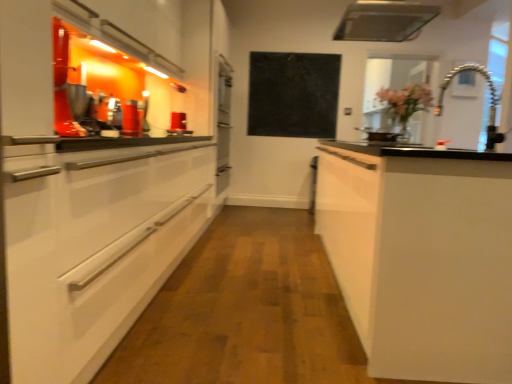
Question: Would you say flexible metallic faucet at upper right contains white matte cabinet at right?

Choices:
 (A) no
 (B) yes

Answer: (A)

Question: Is flexible metallic faucet at upper right further to camera compared to white matte cabinet at right?

Choices:
 (A) no
 (B) yes

Answer: (B)

Question: Is flexible metallic faucet at upper right placed right next to white matte cabinet at right?

Choices:
 (A) yes
 (B) no

Answer: (B)

Question: From the image's perspective, is flexible metallic faucet at upper right beneath white matte cabinet at right?

Choices:
 (A) yes
 (B) no

Answer: (B)

Question: Does flexible metallic faucet at upper right turn towards white matte cabinet at right?

Choices:
 (A) yes
 (B) no

Answer: (B)

Question: Based on their positions, is flexible metallic faucet at upper right located to the left or right of white matte cabinet at right?

Choices:
 (A) left
 (B) right

Answer: (B)

Question: Looking at their shapes, would you say flexible metallic faucet at upper right is wider or thinner than white matte cabinet at right?

Choices:
 (A) thin
 (B) wide

Answer: (A)

Question: Does point (494, 119) appear closer or farther from the camera than point (424, 253)?

Choices:
 (A) farther
 (B) closer

Answer: (A)

Question: From the image's perspective, is flexible metallic faucet at upper right above or below white matte cabinet at right?

Choices:
 (A) below
 (B) above

Answer: (B)

Question: Is white matte cabinet at right in front of or behind transparent glass window at upper right in the image?

Choices:
 (A) front
 (B) behind

Answer: (A)

Question: Based on their sizes in the image, would you say white matte cabinet at right is bigger or smaller than transparent glass window at upper right?

Choices:
 (A) big
 (B) small

Answer: (A)

Question: Would you say white matte cabinet at right is to the left or to the right of transparent glass window at upper right in the picture?

Choices:
 (A) left
 (B) right

Answer: (A)

Question: From the image's perspective, is white matte cabinet at right positioned above or below transparent glass window at upper right?

Choices:
 (A) above
 (B) below

Answer: (B)

Question: Is flexible metallic faucet at upper right taller or shorter than transparent glass window at upper right?

Choices:
 (A) tall
 (B) short

Answer: (B)

Question: Relative to transparent glass window at upper right, is flexible metallic faucet at upper right in front or behind?

Choices:
 (A) front
 (B) behind

Answer: (A)